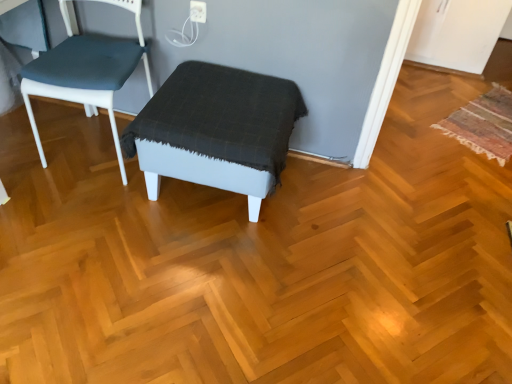
Question: Is multicolored woven mat at right at the left side of matte gray stool at center?

Choices:
 (A) yes
 (B) no

Answer: (B)

Question: Are multicolored woven mat at right and matte gray stool at center making contact?

Choices:
 (A) yes
 (B) no

Answer: (B)

Question: Is multicolored woven mat at right at the right side of matte gray stool at center?

Choices:
 (A) no
 (B) yes

Answer: (B)

Question: Does multicolored woven mat at right have a lesser height compared to matte gray stool at center?

Choices:
 (A) no
 (B) yes

Answer: (B)

Question: From the image's perspective, is multicolored woven mat at right above matte gray stool at center?

Choices:
 (A) yes
 (B) no

Answer: (A)

Question: Based on their sizes in the image, would you say matte gray stool at center is bigger or smaller than multicolored woven mat at right?

Choices:
 (A) small
 (B) big

Answer: (B)

Question: Is matte gray stool at center taller or shorter than multicolored woven mat at right?

Choices:
 (A) short
 (B) tall

Answer: (B)

Question: From the image's perspective, is matte gray stool at center above or below multicolored woven mat at right?

Choices:
 (A) above
 (B) below

Answer: (B)

Question: Considering their positions, is matte gray stool at center located in front of or behind multicolored woven mat at right?

Choices:
 (A) behind
 (B) front

Answer: (B)

Question: Choose the correct answer: Is matte blue fabric chair at left inside multicolored woven mat at right or outside it?

Choices:
 (A) inside
 (B) outside

Answer: (B)

Question: Based on their positions, is matte blue fabric chair at left located to the left or right of multicolored woven mat at right?

Choices:
 (A) left
 (B) right

Answer: (A)

Question: Is matte blue fabric chair at left wider or thinner than multicolored woven mat at right?

Choices:
 (A) wide
 (B) thin

Answer: (B)

Question: Is matte blue fabric chair at left bigger or smaller than multicolored woven mat at right?

Choices:
 (A) small
 (B) big

Answer: (B)

Question: From the image's perspective, is multicolored woven mat at right positioned above or below matte blue fabric chair at left?

Choices:
 (A) below
 (B) above

Answer: (A)

Question: Is multicolored woven mat at right wider or thinner than matte blue fabric chair at left?

Choices:
 (A) wide
 (B) thin

Answer: (A)